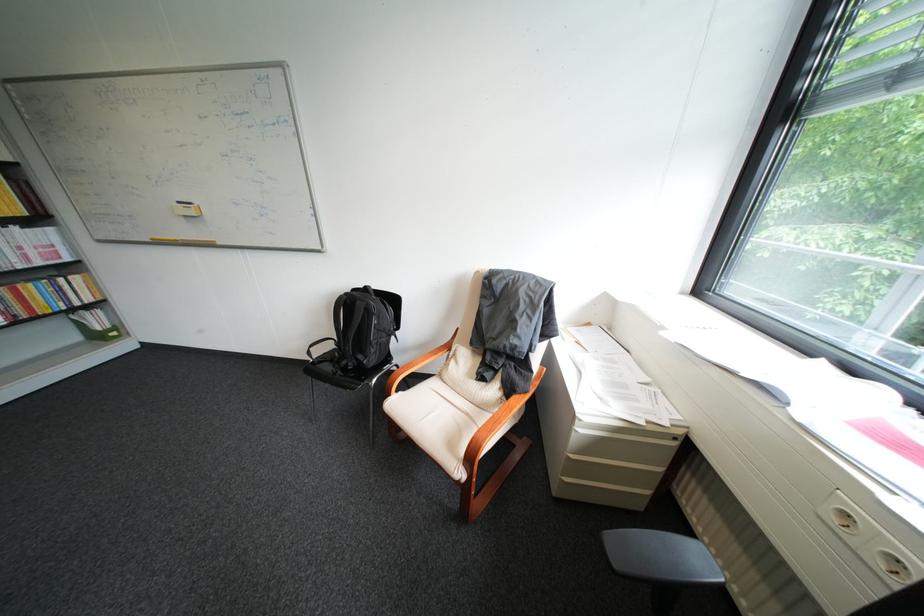
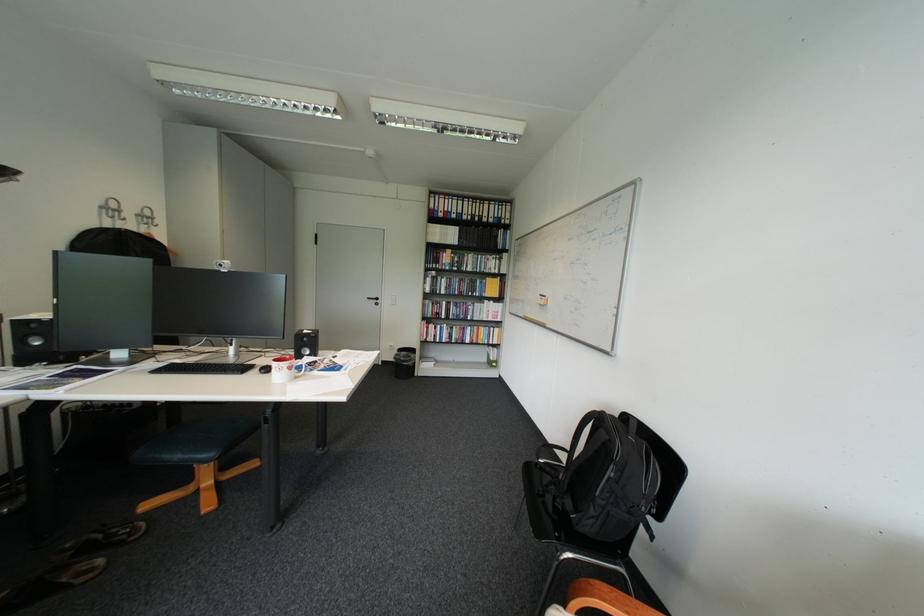
Where in the second image is the point corresponding to (383,342) from the first image?

(608, 496)